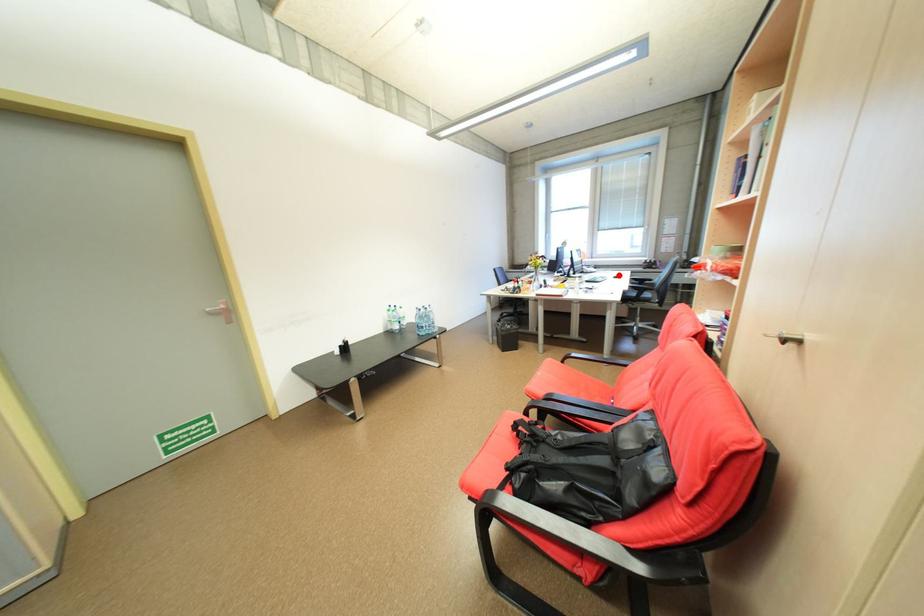
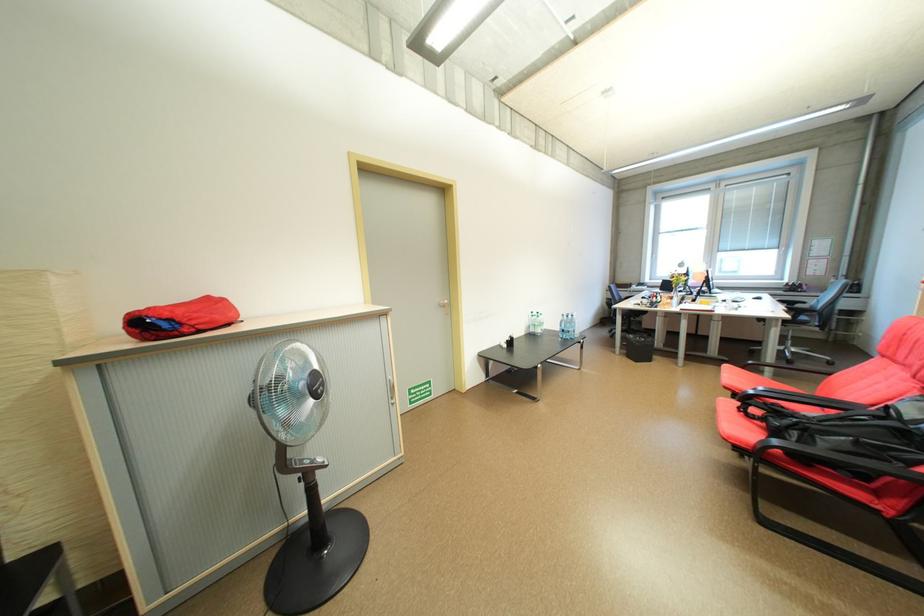
Where in the second image is the point corresponding to the highlighted location from the first image?

(758, 296)